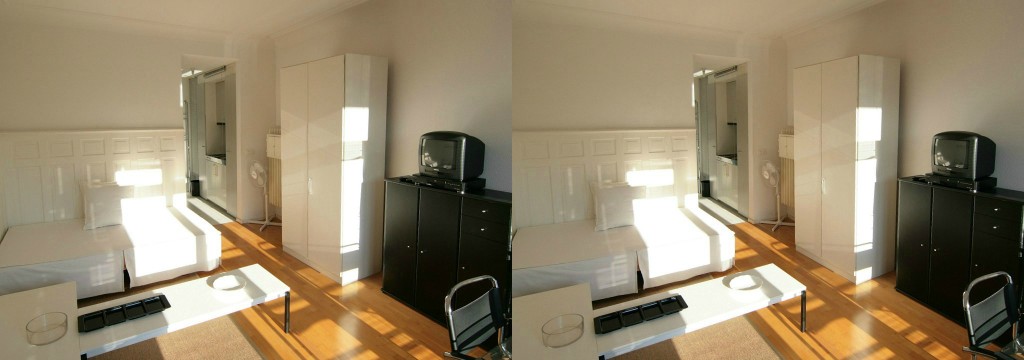
Where is `floor`? The image size is (1024, 360). floor is located at coordinates (851, 327), (326, 339).